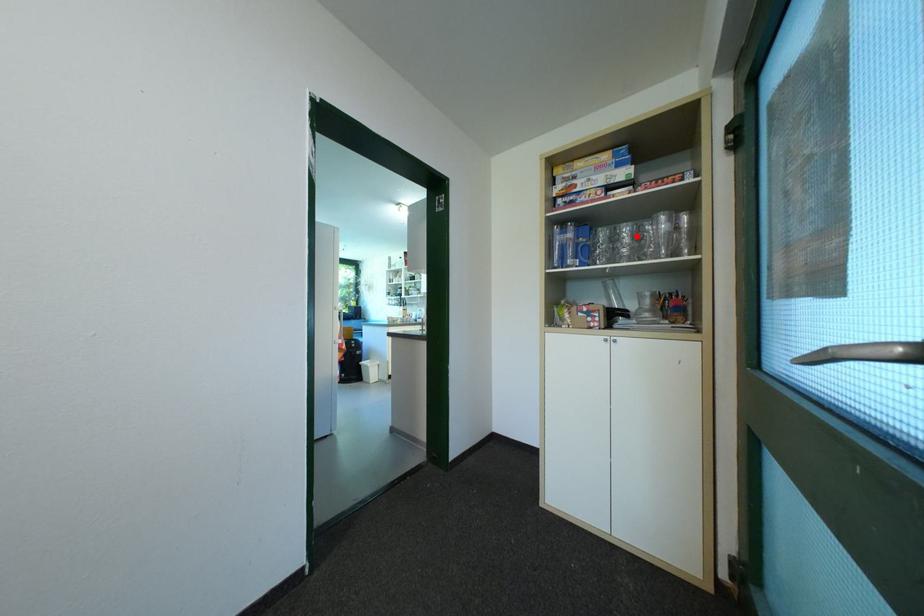
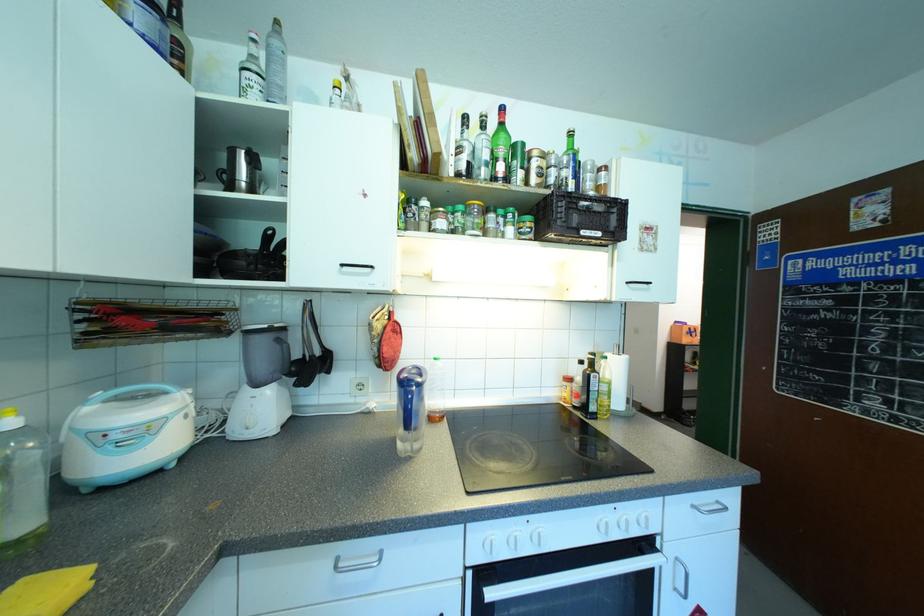
Question: I am providing you with two images of the same scene from different viewpoints. A red point is marked on the first image. Can you still see the location of the red point in image 2?

Choices:
 (A) Yes
 (B) No

Answer: (B)